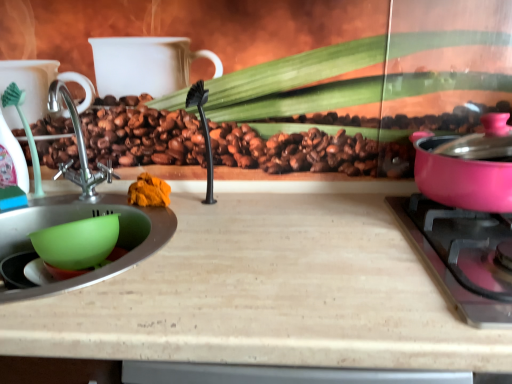
Question: Would you say green plastic mixing bowl at lower left is to the left or to the right of pink glossy pot at right in the picture?

Choices:
 (A) right
 (B) left

Answer: (B)

Question: Is point tap(72, 261) closer or farther from the camera than point tap(486, 233)?

Choices:
 (A) closer
 (B) farther

Answer: (B)

Question: Which object is positioned farthest from the green plastic mixing bowl at lower left?

Choices:
 (A) wooden cutting board at center
 (B) pink glossy pot at right
 (C) pink glossy pot at right

Answer: (B)

Question: Estimate the real-world distances between objects in this image. Which object is farther from the pink glossy pot at right?

Choices:
 (A) green plastic mixing bowl at lower left
 (B) wooden cutting board at center
 (C) pink glossy pot at right

Answer: (A)